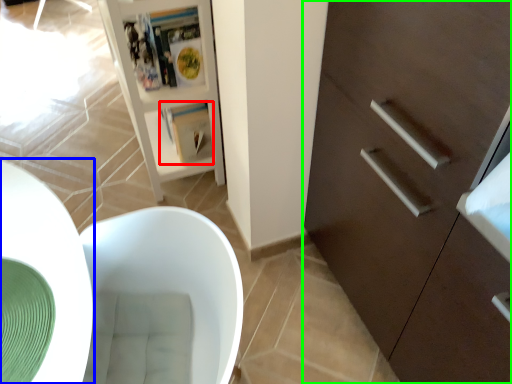
Question: Based on their relative distances, which object is farther from magazine (highlighted by a red box)? Choose from round table (highlighted by a blue box) and cabinetry (highlighted by a green box).

Choices:
 (A) round table
 (B) cabinetry

Answer: (B)